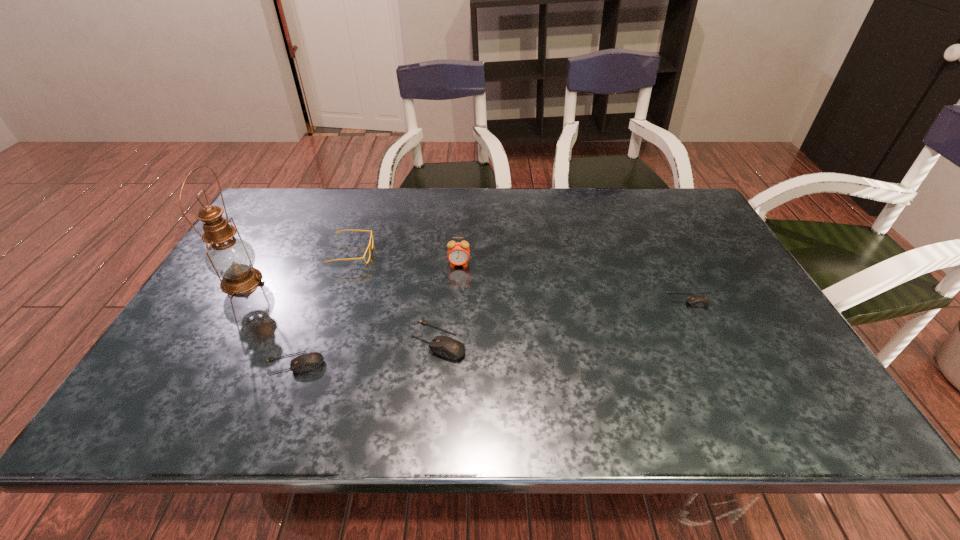
I want to click on vacant space that is in between the second shortest mouse and the oil lamp, so click(x=268, y=322).

You are a GUI agent. You are given a task and a screenshot of the screen. Output one action in this format:
    pyautogui.click(x=<x>, y=<y>)
    Task: Click on the vacant area that lies between the second tallest mouse and the oil lamp
    
    Given the screenshot: What is the action you would take?
    pyautogui.click(x=268, y=322)

I want to click on vacant space that's between the spectacles and the fourth tallest object, so click(x=396, y=297).

What are the coordinates of `vacant space that is in between the rightmost mouse and the leftmost object` in the screenshot? It's located at (465, 290).

Identify which object is the nearest to the tallest mouse. Please provide its 2D coordinates. Your answer should be formatted as a tuple, i.e. [(x, y)], where the tuple contains the x and y coordinates of a point satisfying the conditions above.

[(306, 362)]

Locate which object ranks third in proximity to the shortest mouse. Please provide its 2D coordinates. Your answer should be formatted as a tuple, i.e. [(x, y)], where the tuple contains the x and y coordinates of a point satisfying the conditions above.

[(369, 246)]

Locate an element on the screen. The image size is (960, 540). mouse that is the second closest to the shortest mouse is located at coordinates (306, 362).

Select which mouse is the third closest to the oil lamp. Please provide its 2D coordinates. Your answer should be formatted as a tuple, i.e. [(x, y)], where the tuple contains the x and y coordinates of a point satisfying the conditions above.

[(694, 300)]

At what (x,y) coordinates should I click in order to perform the action: click on free location that satisfies the following two spatial constraints: 1. in front of the lenses of the second mouse from left to right; 2. on the left side of the third tallest object. Please return your answer as a coordinate pair (x, y). Looking at the image, I should click on 323,340.

Image resolution: width=960 pixels, height=540 pixels. What are the coordinates of `vacant space that satisfies the following two spatial constraints: 1. on the back side of the second mouse from right to left; 2. in front of the lenses of the spectacles` in the screenshot? It's located at [x=446, y=254].